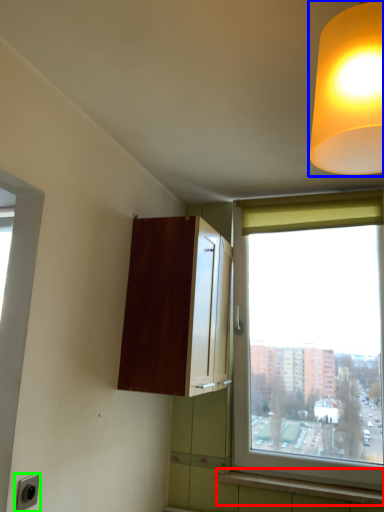
Question: Estimate the real-world distances between objects in this image. Which object is closer to window sill (highlighted by a red box), lamp (highlighted by a blue box) or electric outlet (highlighted by a green box)?

Choices:
 (A) lamp
 (B) electric outlet

Answer: (B)